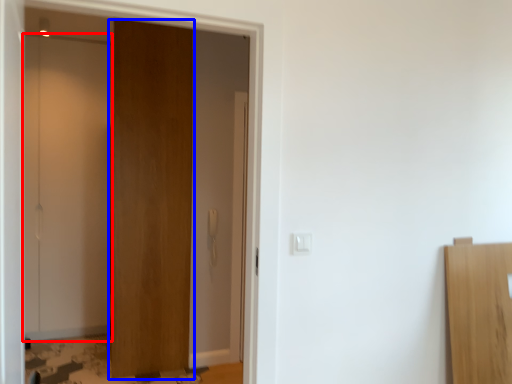
Question: Which of the following is the closest to the observer, door (highlighted by a red box) or door (highlighted by a blue box)?

Choices:
 (A) door
 (B) door

Answer: (B)